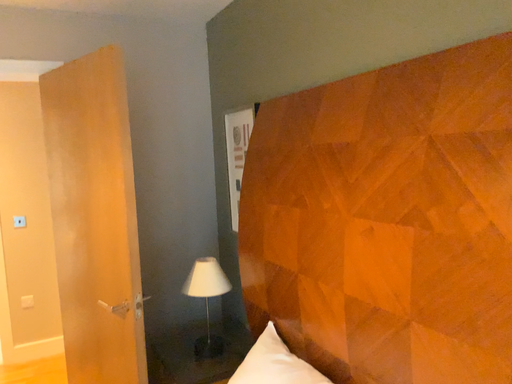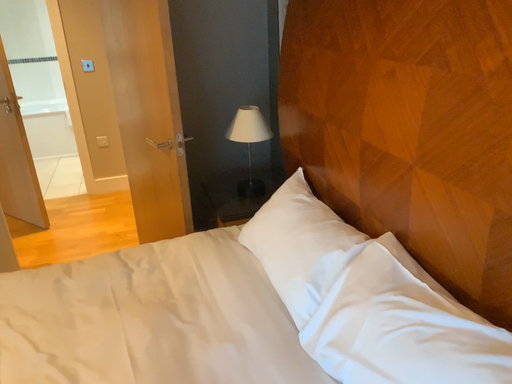
Question: How did the camera likely rotate when shooting the video?

Choices:
 (A) rotated right
 (B) rotated left

Answer: (B)